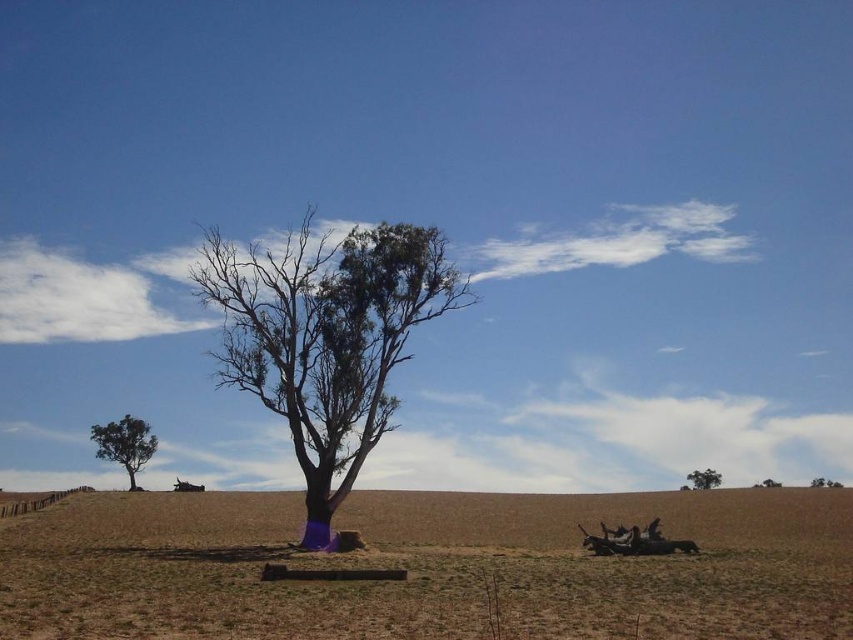
Question: Which point is closer to the camera?

Choices:
 (A) green leafy tree at center
 (B) green leafy tree at lower left

Answer: (A)

Question: Can you confirm if brown dry grass at center is thinner than green leafy tree at upper right?

Choices:
 (A) yes
 (B) no

Answer: (B)

Question: Does green leafy tree at center have a smaller size compared to green leafy tree at lower left?

Choices:
 (A) no
 (B) yes

Answer: (A)

Question: Among these points, which one is nearest to the camera?

Choices:
 (A) (589, 627)
 (B) (140, 442)
 (C) (816, 480)
 (D) (704, 488)

Answer: (A)

Question: Can you confirm if brown dry grass at center is smaller than green leafy tree at center?

Choices:
 (A) no
 (B) yes

Answer: (A)

Question: Which point is closer to the camera?

Choices:
 (A) green leafy tree at lower left
 (B) green leafy tree at center
 (C) green leafy tree at upper right

Answer: (B)